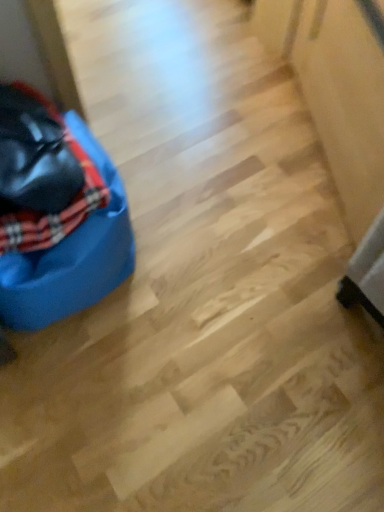
What do you see at coordinates (72, 255) in the screenshot? I see `blue fabric bean bag at left` at bounding box center [72, 255].

Find the location of a particular element. blue fabric bean bag at left is located at coordinates (72, 255).

Find the location of a particular element. This screenshot has height=512, width=384. blue fabric bean bag at left is located at coordinates (72, 255).